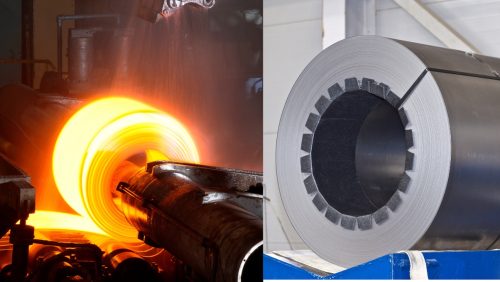
Where is `beam`? beam is located at coordinates (343, 15).